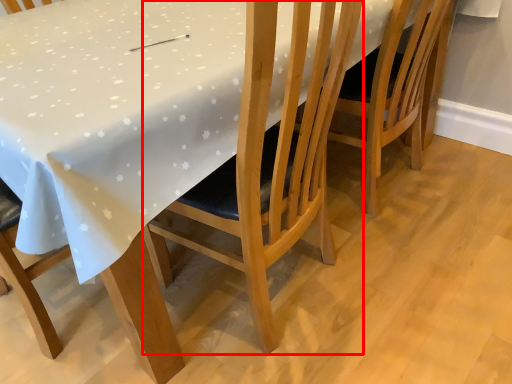
Question: Where is chair (annotated by the red box) located in relation to chair in the image?

Choices:
 (A) right
 (B) left

Answer: (B)